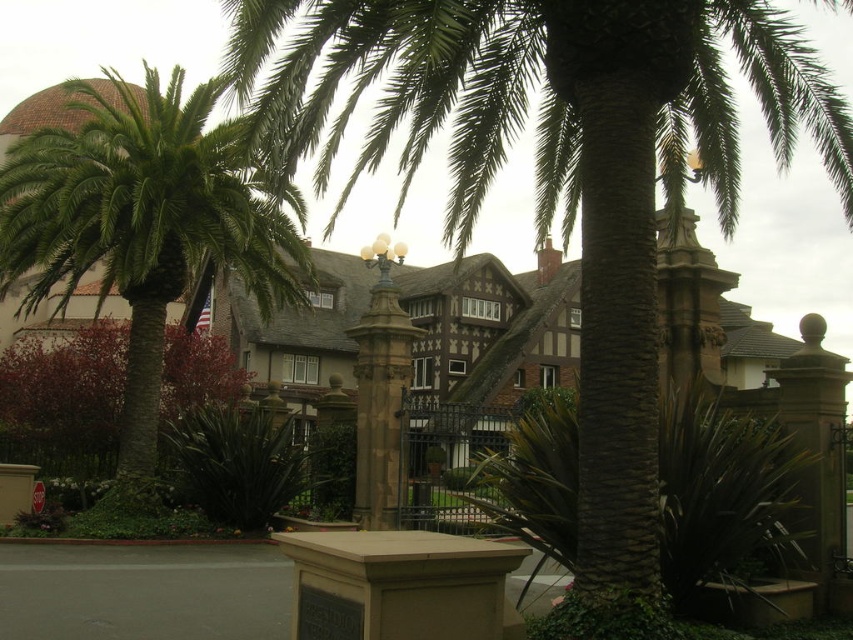
You are a landscape architect designing a pathway between the green leafy palm tree at center and the green leafy palm at left. The pathway must be straight and 2 meters wide. Can the pathway fit between them without bending around either tree?

The distance between the green leafy palm tree at center and the green leafy palm at left is 17.62 meters. Since the pathway only needs to be 2 meters wide, it can easily fit between them without bending around either tree.

You are a visitor approaching the stone gate and want to take a photo of the historic building through the gap between the green leafy palm tree at center and the green leafy palm at left. Which palm tree should you move closer to in order to have a better view of the building?

The green leafy palm tree at center is bigger than the green leafy palm at left, so moving closer to the smaller green leafy palm at left would provide a better view of the building through the gap.